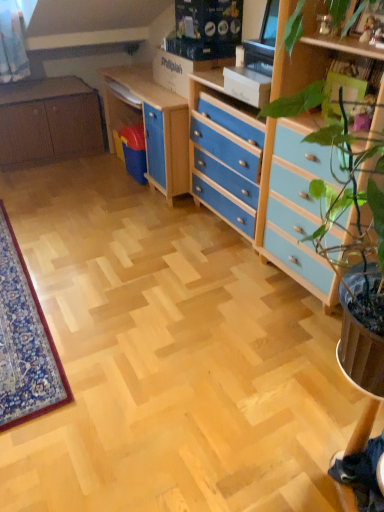
Question: From the image's perspective, is matte brown cabinet at left located beneath matte wood computer desk at center?

Choices:
 (A) no
 (B) yes

Answer: (A)

Question: From a real-world perspective, is matte brown cabinet at left located beneath matte wood computer desk at center?

Choices:
 (A) no
 (B) yes

Answer: (A)

Question: Is matte wood computer desk at center located within matte brown cabinet at left?

Choices:
 (A) yes
 (B) no

Answer: (B)

Question: Does matte brown cabinet at left have a larger size compared to matte wood computer desk at center?

Choices:
 (A) yes
 (B) no

Answer: (A)

Question: Is matte brown cabinet at left further to camera compared to matte wood computer desk at center?

Choices:
 (A) no
 (B) yes

Answer: (B)

Question: Choose the correct answer: Is blue painted wood chest of drawers at center right inside matte brown cabinet at left or outside it?

Choices:
 (A) outside
 (B) inside

Answer: (A)

Question: From their relative heights in the image, would you say blue painted wood chest of drawers at center right is taller or shorter than matte brown cabinet at left?

Choices:
 (A) short
 (B) tall

Answer: (B)

Question: Based on their positions, is blue painted wood chest of drawers at center right located to the left or right of matte brown cabinet at left?

Choices:
 (A) right
 (B) left

Answer: (A)

Question: Is blue painted wood chest of drawers at center right wider or thinner than matte brown cabinet at left?

Choices:
 (A) wide
 (B) thin

Answer: (B)

Question: Is matte wood computer desk at center to the left or to the right of matte brown cabinet at left in the image?

Choices:
 (A) right
 (B) left

Answer: (A)

Question: Is matte wood computer desk at center situated inside matte brown cabinet at left or outside?

Choices:
 (A) outside
 (B) inside

Answer: (A)

Question: Looking at the image, does matte wood computer desk at center seem bigger or smaller compared to matte brown cabinet at left?

Choices:
 (A) big
 (B) small

Answer: (B)

Question: Relative to matte brown cabinet at left, is matte wood computer desk at center in front or behind?

Choices:
 (A) front
 (B) behind

Answer: (A)

Question: In the image, is matte brown cabinet at left positioned in front of or behind blue painted wood chest of drawers at center right?

Choices:
 (A) front
 (B) behind

Answer: (B)

Question: Considering the positions of point (3, 88) and point (208, 162), is point (3, 88) closer or farther from the camera than point (208, 162)?

Choices:
 (A) farther
 (B) closer

Answer: (A)